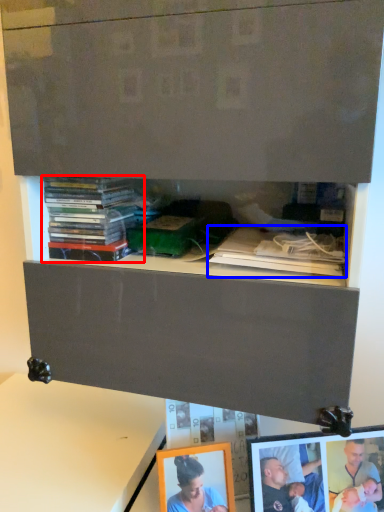
Question: Which point is further to the camera, book (highlighted by a red box) or book (highlighted by a blue box)?

Choices:
 (A) book
 (B) book

Answer: (A)